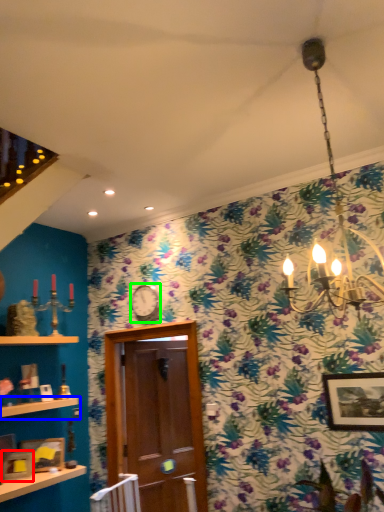
Question: Estimate the real-world distances between objects in this image. Which object is farther from picture frame (highlighted by a red box), shelf (highlighted by a blue box) or clock (highlighted by a green box)?

Choices:
 (A) shelf
 (B) clock

Answer: (B)